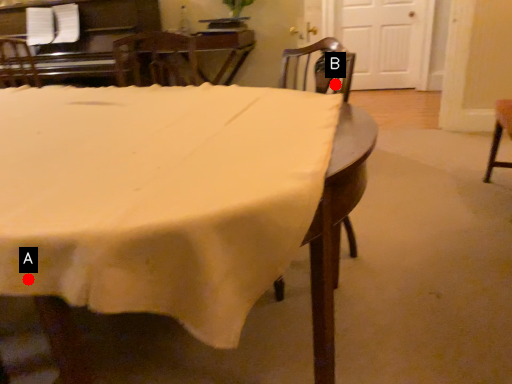
Question: Two points are circled on the image, labeled by A and B beside each circle. Which point is closer to the camera?

Choices:
 (A) A is closer
 (B) B is closer

Answer: (A)